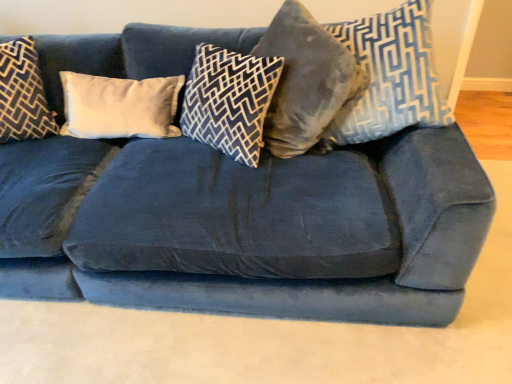
In order to face velvet blue pillow at upper right, which appears as the first pillow when viewed from the right, should I rotate leftwards or rightwards?

Rotate your view right by about 17.156°.

Describe the element at coordinates (23, 94) in the screenshot. I see `dark blue velvet pillow at left, the 5th pillow in the right-to-left sequence` at that location.

The image size is (512, 384). Identify the location of dark blue velvet pillow at left, the 5th pillow in the right-to-left sequence. (23, 94).

Image resolution: width=512 pixels, height=384 pixels. In order to click on white velvet pillow at center, the 2th pillow from the left in this screenshot , I will do `click(119, 106)`.

At what (x,y) coordinates should I click in order to perform the action: click on velvet blue pillow at upper right, which appears as the first pillow when viewed from the right. Please return your answer as a coordinate pair (x, y). The image size is (512, 384). Looking at the image, I should click on (389, 76).

From the image's perspective, relative to dark blue velvet pillow at left, which appears as the first pillow when viewed from the left, is white velvet pillow at center, which is counted as the fourth pillow, starting from the right, above or below?

white velvet pillow at center, which is counted as the fourth pillow, starting from the right, is situated lower than dark blue velvet pillow at left, which appears as the first pillow when viewed from the left, in the image.

Measure the distance from white velvet pillow at center, the 2th pillow from the left, to dark blue velvet pillow at left, the 5th pillow in the right-to-left sequence.

They are 9.18 inches apart.

How different are the orientations of white velvet pillow at center, which is counted as the fourth pillow, starting from the right, and dark blue velvet pillow at left, which appears as the first pillow when viewed from the left, in degrees?

They differ by 0.0108 degrees in their facing directions.

Is white velvet pillow at center, the 2th pillow from the left, facing away from dark blue velvet pillow at left, which appears as the first pillow when viewed from the left?

No, dark blue velvet pillow at left, which appears as the first pillow when viewed from the left, is not at the back of white velvet pillow at center, the 2th pillow from the left.

From the image's perspective, would you say velvet blue pillow at upper right, which appears as the first pillow when viewed from the right, is positioned over velvet blue pillow at center, the third pillow from the right?

Indeed, from the image's perspective, velvet blue pillow at upper right, which appears as the first pillow when viewed from the right, is shown above velvet blue pillow at center, the third pillow from the right.

Between velvet blue pillow at upper right, the fifth pillow when ordered from left to right, and velvet blue pillow at center, the third pillow from the right, which one has smaller size?

With smaller size is velvet blue pillow at center, the third pillow from the right.

I want to click on the 2nd pillow in front of the velvet blue pillow at center, marked as the 3th pillow in a left-to-right arrangement, counting from the anchor's position, so click(389, 76).

Does velvet blue pillow at upper right, which appears as the first pillow when viewed from the right, have a greater width compared to velvet blue pillow at center, marked as the 3th pillow in a left-to-right arrangement?

In fact, velvet blue pillow at upper right, which appears as the first pillow when viewed from the right, might be narrower than velvet blue pillow at center, marked as the 3th pillow in a left-to-right arrangement.

What's the angular difference between velvet blue pillow at center, marked as the 3th pillow in a left-to-right arrangement, and velvet gray pillow at center, which ranks as the fourth pillow in left-to-right order,'s facing directions?

The angle between the facing direction of velvet blue pillow at center, marked as the 3th pillow in a left-to-right arrangement, and the facing direction of velvet gray pillow at center, which ranks as the fourth pillow in left-to-right order, is 0.00158 degrees.

Who is bigger, velvet blue pillow at center, the third pillow from the right, or velvet gray pillow at center, which ranks as the fourth pillow in left-to-right order?

With larger size is velvet gray pillow at center, which ranks as the fourth pillow in left-to-right order.

Is there a large distance between velvet blue pillow at center, the third pillow from the right, and velvet gray pillow at center, which ranks as the fourth pillow in left-to-right order?

velvet blue pillow at center, the third pillow from the right, is near velvet gray pillow at center, which ranks as the fourth pillow in left-to-right order, not far away.

Looking at this image, can you confirm if velvet blue pillow at center, marked as the 3th pillow in a left-to-right arrangement, is wider than velvet gray pillow at center, which ranks as the fourth pillow in left-to-right order?

Yes, velvet blue pillow at center, marked as the 3th pillow in a left-to-right arrangement, is wider than velvet gray pillow at center, which ranks as the fourth pillow in left-to-right order.

From the image's perspective, is dark blue velvet pillow at left, the 5th pillow in the right-to-left sequence, below white velvet pillow at center, which is counted as the fourth pillow, starting from the right?

No, from the image's perspective, dark blue velvet pillow at left, the 5th pillow in the right-to-left sequence, is not beneath white velvet pillow at center, which is counted as the fourth pillow, starting from the right.

What's the angular difference between dark blue velvet pillow at left, the 5th pillow in the right-to-left sequence, and white velvet pillow at center, which is counted as the fourth pillow, starting from the right,'s facing directions?

The facing directions of dark blue velvet pillow at left, the 5th pillow in the right-to-left sequence, and white velvet pillow at center, which is counted as the fourth pillow, starting from the right, are 0.0108 degrees apart.

Is the position of dark blue velvet pillow at left, the 5th pillow in the right-to-left sequence, more distant than that of white velvet pillow at center, the 2th pillow from the left?

No, dark blue velvet pillow at left, the 5th pillow in the right-to-left sequence, is closer to the viewer.

Can you confirm if dark blue velvet pillow at left, which appears as the first pillow when viewed from the left, is smaller than white velvet pillow at center, the 2th pillow from the left?

Incorrect, dark blue velvet pillow at left, which appears as the first pillow when viewed from the left, is not smaller in size than white velvet pillow at center, the 2th pillow from the left.

Is dark blue velvet pillow at left, which appears as the first pillow when viewed from the left, positioned with its back to velvet blue pillow at upper right, which appears as the first pillow when viewed from the right?

No.

Would you consider dark blue velvet pillow at left, the 5th pillow in the right-to-left sequence, to be distant from velvet blue pillow at upper right, the fifth pillow when ordered from left to right?

That's right, there is a large distance between dark blue velvet pillow at left, the 5th pillow in the right-to-left sequence, and velvet blue pillow at upper right, the fifth pillow when ordered from left to right.

Does point (2, 62) come closer to viewer compared to point (407, 103)?

No, (2, 62) is behind (407, 103).

Who is smaller, velvet gray pillow at center, which ranks as the fourth pillow in left-to-right order, or velvet blue pillow at upper right, which appears as the first pillow when viewed from the right?

Smaller between the two is velvet blue pillow at upper right, which appears as the first pillow when viewed from the right.

Looking at their sizes, would you say velvet gray pillow at center, marked as the 2th pillow in a right-to-left arrangement, is wider or thinner than velvet blue pillow at upper right, the fifth pillow when ordered from left to right?

Clearly, velvet gray pillow at center, marked as the 2th pillow in a right-to-left arrangement, has less width compared to velvet blue pillow at upper right, the fifth pillow when ordered from left to right.

I want to click on pillow above the velvet gray pillow at center, marked as the 2th pillow in a right-to-left arrangement (from the image's perspective), so click(389, 76).

In the image, is velvet gray pillow at center, which ranks as the fourth pillow in left-to-right order, on the left side or the right side of velvet blue pillow at upper right, the fifth pillow when ordered from left to right?

In the image, velvet gray pillow at center, which ranks as the fourth pillow in left-to-right order, appears on the left side of velvet blue pillow at upper right, the fifth pillow when ordered from left to right.

Between velvet blue pillow at center, marked as the 3th pillow in a left-to-right arrangement, and dark blue velvet pillow at left, which appears as the first pillow when viewed from the left, which one appears on the left side from the viewer's perspective?

Positioned to the left is dark blue velvet pillow at left, which appears as the first pillow when viewed from the left.

Can you confirm if velvet blue pillow at center, the third pillow from the right, is smaller than dark blue velvet pillow at left, the 5th pillow in the right-to-left sequence?

Yes, velvet blue pillow at center, the third pillow from the right, is smaller than dark blue velvet pillow at left, the 5th pillow in the right-to-left sequence.

Does velvet blue pillow at center, the third pillow from the right, touch dark blue velvet pillow at left, the 5th pillow in the right-to-left sequence?

No, velvet blue pillow at center, the third pillow from the right, is not with dark blue velvet pillow at left, the 5th pillow in the right-to-left sequence.

Is velvet blue pillow at center, the third pillow from the right, outside of dark blue velvet pillow at left, the 5th pillow in the right-to-left sequence?

Yes, velvet blue pillow at center, the third pillow from the right, is not within dark blue velvet pillow at left, the 5th pillow in the right-to-left sequence.

I want to click on the 2nd pillow positioned above the white velvet pillow at center, the 2th pillow from the left (from a real-world perspective), so click(23, 94).

Identify the location of the 2nd pillow to the right of the velvet blue pillow at center, marked as the 3th pillow in a left-to-right arrangement, starting your count from the anchor. (389, 76).

In the scene shown: Looking at the image, which one is located closer to velvet gray pillow at center, marked as the 2th pillow in a right-to-left arrangement, velvet blue pillow at center, marked as the 3th pillow in a left-to-right arrangement, or velvet blue pillow at upper right, which appears as the first pillow when viewed from the right?

velvet blue pillow at upper right, which appears as the first pillow when viewed from the right, is closer to velvet gray pillow at center, marked as the 2th pillow in a right-to-left arrangement.

Which object lies further to the anchor point velvet blue pillow at center, marked as the 3th pillow in a left-to-right arrangement, white velvet pillow at center, which is counted as the fourth pillow, starting from the right, or dark blue velvet pillow at left, which appears as the first pillow when viewed from the left?

The object further to velvet blue pillow at center, marked as the 3th pillow in a left-to-right arrangement, is dark blue velvet pillow at left, which appears as the first pillow when viewed from the left.

From the image, which object appears to be farther from white velvet pillow at center, which is counted as the fourth pillow, starting from the right, dark blue velvet pillow at left, the 5th pillow in the right-to-left sequence, or velvet gray pillow at center, marked as the 2th pillow in a right-to-left arrangement?

Based on the image, velvet gray pillow at center, marked as the 2th pillow in a right-to-left arrangement, appears to be further to white velvet pillow at center, which is counted as the fourth pillow, starting from the right.

Looking at the image, which one is located closer to velvet blue pillow at center, the third pillow from the right, velvet gray pillow at center, marked as the 2th pillow in a right-to-left arrangement, or velvet blue pillow at upper right, the fifth pillow when ordered from left to right?

velvet gray pillow at center, marked as the 2th pillow in a right-to-left arrangement.

Considering their positions, is white velvet pillow at center, the 2th pillow from the left, positioned closer to velvet blue pillow at upper right, which appears as the first pillow when viewed from the right, than velvet gray pillow at center, which ranks as the fourth pillow in left-to-right order?

velvet gray pillow at center, which ranks as the fourth pillow in left-to-right order, is positioned closer to the anchor velvet blue pillow at upper right, which appears as the first pillow when viewed from the right.

Based on their spatial positions, is velvet gray pillow at center, which ranks as the fourth pillow in left-to-right order, or velvet blue pillow at center, the third pillow from the right, further from velvet blue pillow at upper right, the fifth pillow when ordered from left to right?

Among the two, velvet blue pillow at center, the third pillow from the right, is located further to velvet blue pillow at upper right, the fifth pillow when ordered from left to right.

Based on their spatial positions, is velvet blue pillow at center, marked as the 3th pillow in a left-to-right arrangement, or dark blue velvet pillow at left, the 5th pillow in the right-to-left sequence, further from velvet blue pillow at upper right, the fifth pillow when ordered from left to right?

dark blue velvet pillow at left, the 5th pillow in the right-to-left sequence, lies further to velvet blue pillow at upper right, the fifth pillow when ordered from left to right, than the other object.

From the picture: Which object lies nearer to the anchor point velvet blue pillow at center, the third pillow from the right, dark blue velvet pillow at left, which appears as the first pillow when viewed from the left, or velvet blue pillow at upper right, which appears as the first pillow when viewed from the right?

velvet blue pillow at upper right, which appears as the first pillow when viewed from the right.

Find the location of a particular element. pillow located between dark blue velvet pillow at left, the 5th pillow in the right-to-left sequence, and velvet blue pillow at center, the third pillow from the right, in the left-right direction is located at coordinates (119, 106).

What are the coordinates of `pillow between velvet blue pillow at center, the third pillow from the right, and velvet blue pillow at upper right, the fifth pillow when ordered from left to right` in the screenshot? It's located at (305, 80).

Identify the location of pillow between white velvet pillow at center, the 2th pillow from the left, and velvet gray pillow at center, which ranks as the fourth pillow in left-to-right order, from left to right. This screenshot has height=384, width=512. (229, 101).